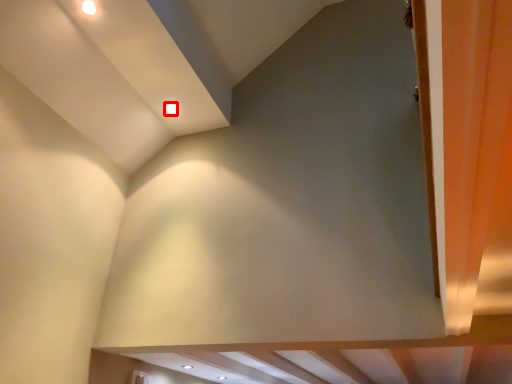
Question: From the image, what is the correct spatial relationship of lighting (annotated by the red box) in relation to curtain?

Choices:
 (A) right
 (B) left

Answer: (B)